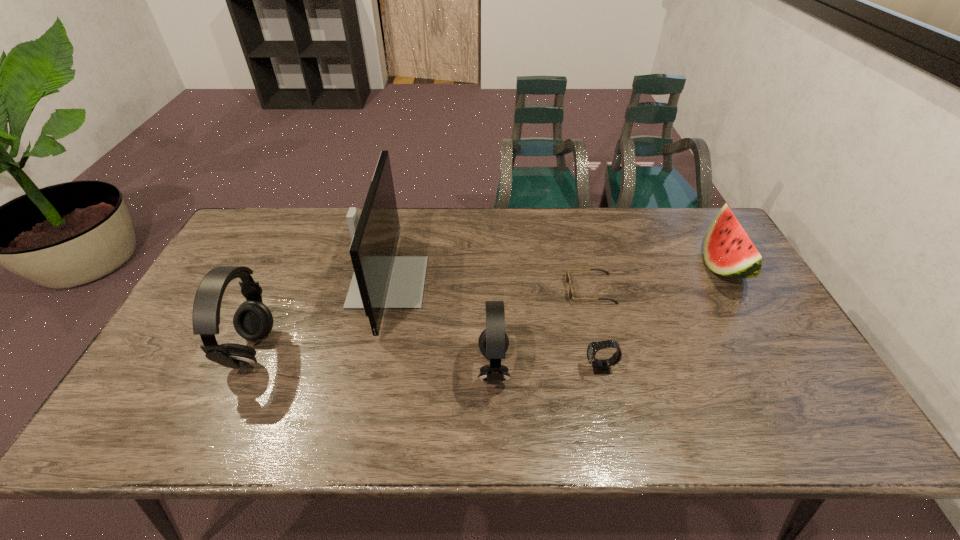
Where is `vacant area situated on the outer rind of the third shortest object`? The image size is (960, 540). vacant area situated on the outer rind of the third shortest object is located at coordinates (678, 266).

Image resolution: width=960 pixels, height=540 pixels. I want to click on vacant region located 0.390m on the outer rind of the third shortest object, so click(x=578, y=266).

Image resolution: width=960 pixels, height=540 pixels. Find the location of `free region located 0.280m on the face of the watch`. free region located 0.280m on the face of the watch is located at coordinates (472, 368).

Locate an element on the screen. free space located 0.350m on the face of the watch is located at coordinates [444, 368].

The width and height of the screenshot is (960, 540). I want to click on free point located 0.070m on the face of the watch, so pos(556,368).

Identify the location of computer monitor that is at the far edge. The height and width of the screenshot is (540, 960). (381, 280).

Identify the location of watermelon that is positioned at the far edge. coord(728,251).

The image size is (960, 540). What are the coordinates of `watch positioned at the near edge` in the screenshot? It's located at (599, 366).

Where is `object that is at the right edge`? This screenshot has width=960, height=540. object that is at the right edge is located at coordinates (728, 251).

You are a GUI agent. You are given a task and a screenshot of the screen. Output one action in this format:
    pyautogui.click(x=<x>, y=<y>)
    Task: Click on the object present at the far right corner
    
    Given the screenshot: What is the action you would take?
    pyautogui.click(x=728, y=251)